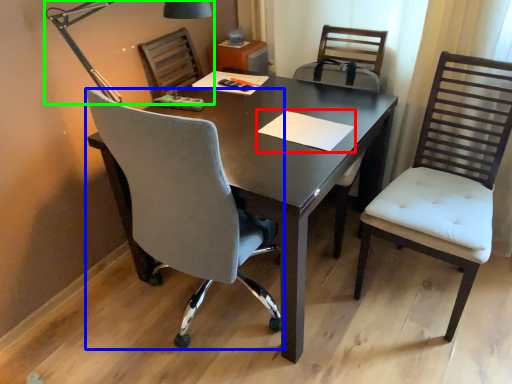
Question: Which object is positioned closest to notepad (highlighted by a red box)? Select from chair (highlighted by a blue box) and lamp (highlighted by a green box).

Choices:
 (A) chair
 (B) lamp

Answer: (A)